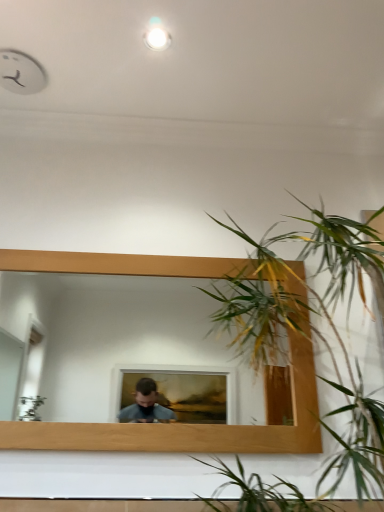
Question: Is wooden mirror at center oriented away from green leafy plant at right?

Choices:
 (A) no
 (B) yes

Answer: (A)

Question: Could you tell me if wooden mirror at center is facing green leafy plant at right?

Choices:
 (A) no
 (B) yes

Answer: (B)

Question: Could green leafy plant at right be considered to be inside wooden mirror at center?

Choices:
 (A) no
 (B) yes

Answer: (A)

Question: Considering the relative sizes of wooden mirror at center and green leafy plant at right in the image provided, is wooden mirror at center taller than green leafy plant at right?

Choices:
 (A) no
 (B) yes

Answer: (A)

Question: From a real-world perspective, is wooden mirror at center on top of green leafy plant at right?

Choices:
 (A) yes
 (B) no

Answer: (B)

Question: From a real-world perspective, is white glossy light at upper center physically located above or below green leafy plant at right?

Choices:
 (A) above
 (B) below

Answer: (A)

Question: Considering their positions, is white glossy light at upper center located in front of or behind green leafy plant at right?

Choices:
 (A) behind
 (B) front

Answer: (A)

Question: Is white glossy light at upper center situated inside green leafy plant at right or outside?

Choices:
 (A) outside
 (B) inside

Answer: (A)

Question: Is white glossy light at upper center wider or thinner than green leafy plant at right?

Choices:
 (A) thin
 (B) wide

Answer: (A)

Question: From the image's perspective, relative to white glossy light at upper center, is wooden mirror at center above or below?

Choices:
 (A) above
 (B) below

Answer: (B)

Question: Is wooden mirror at center in front of or behind white glossy light at upper center in the image?

Choices:
 (A) front
 (B) behind

Answer: (A)

Question: From a real-world perspective, is wooden mirror at center positioned above or below white glossy light at upper center?

Choices:
 (A) above
 (B) below

Answer: (B)

Question: Looking at the image, does wooden mirror at center seem bigger or smaller compared to white glossy light at upper center?

Choices:
 (A) big
 (B) small

Answer: (A)

Question: In the image, is white glossy light at upper center on the left side or the right side of wooden mirror at center?

Choices:
 (A) left
 (B) right

Answer: (B)

Question: From their relative heights in the image, would you say white glossy light at upper center is taller or shorter than wooden mirror at center?

Choices:
 (A) short
 (B) tall

Answer: (A)